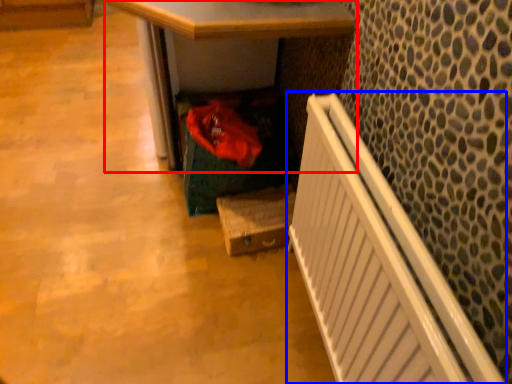
Question: Which point is further to the camera, desk (highlighted by a red box) or radiator (highlighted by a blue box)?

Choices:
 (A) desk
 (B) radiator

Answer: (A)